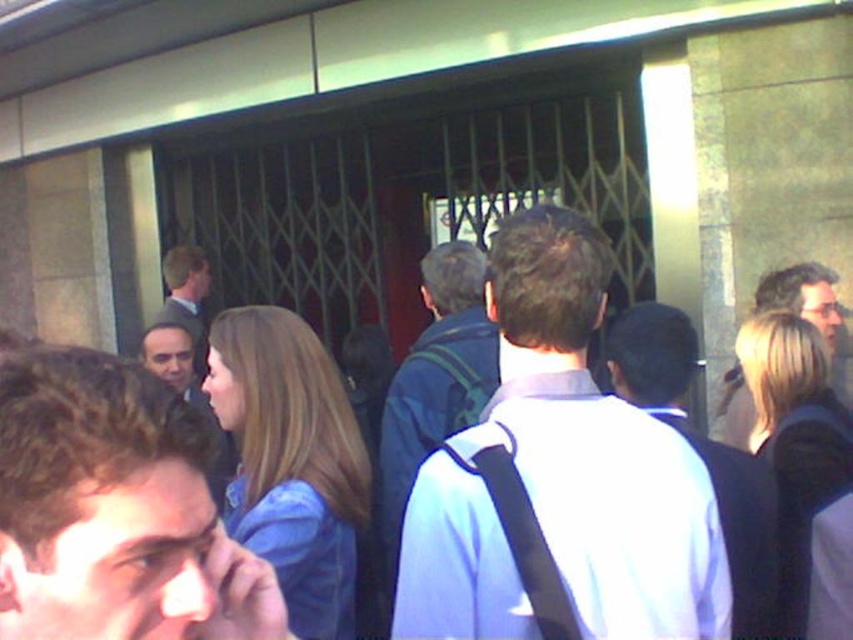
You are a photographer standing in front of the building with the metal security gate. You notice a white matte shirt at center and a dark blue backpack at center. Which object is positioned higher in the image?

The white matte shirt at center is located above the dark blue backpack at center, so it is positioned higher in the image.

You are a photographer standing in front of the building with the metal security gate. You notice a person wearing a white matte shirt at center and a dark blue backpack at center. Which object is nearer to your camera lens?

The white matte shirt at center is closer to the viewer than the dark blue backpack at center, so the white matte shirt at center is nearer to the camera lens.

You are a photographer trying to capture a clear photo of the blue fabric jacket at center and the light brown hair at center. Since the people are moving, you need to focus on the one that is closer to the camera. Which object should you focus on?

The blue fabric jacket at center has a smaller size compared to light brown hair at center, so it is closer to the camera. Focus on the blue fabric jacket at center to capture a clear photo.